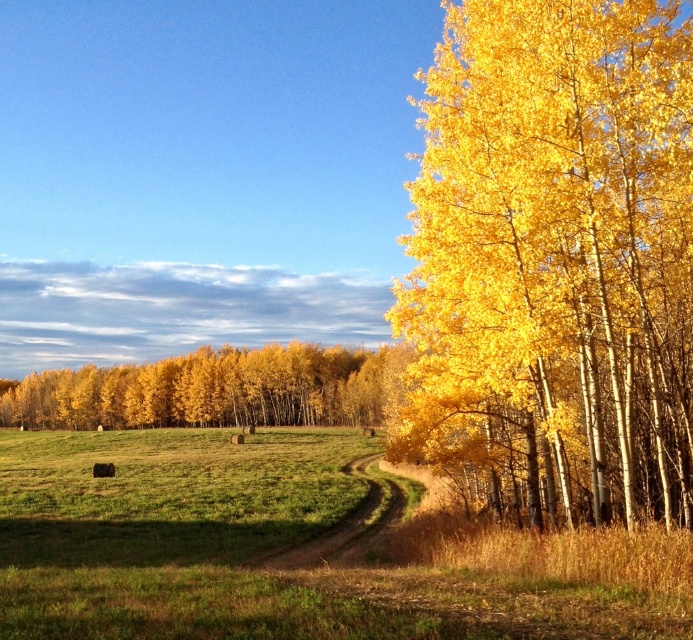
You are planning to take a photo of the golden yellow leaves at center and brown dirt path at center. Which object will occupy more space in your photo?

The golden yellow leaves at center has a larger size compared to the brown dirt path at center, so it will occupy more space in the photo.

You are standing at the edge of the brown dirt path at center and looking towards the golden yellow leaves at center. Which object is taller?

The golden yellow leaves at center are taller than the brown dirt path at center.

You are a hiker standing at the center of the brown dirt path at center. You want to collect the golden yellow leaves at right. Which direction should you move to reach them?

The golden yellow leaves at right are much taller than the brown dirt path at center, so you should move towards the right direction to reach them.